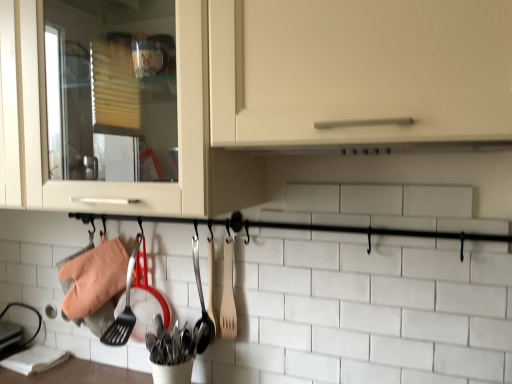
Identify the location of wooden spatula at center. This screenshot has width=512, height=384. (228, 291).

Find the location of a particular element. wooden spoon at center, arranged as the 2th silverware when viewed from the left is located at coordinates (201, 304).

The width and height of the screenshot is (512, 384). I want to click on polished stainless steel utensils at center, which ranks as the 2th silverware in right-to-left order, so click(177, 342).

Is polished stainless steel utensils at center, arranged as the first silverware when viewed from the left, a part of matte white cabinet at center?

No.

Which of these two, matte white cabinet at center or polished stainless steel utensils at center, which ranks as the 2th silverware in right-to-left order, stands shorter?

polished stainless steel utensils at center, which ranks as the 2th silverware in right-to-left order, is shorter.

Does matte white cabinet at center appear on the left side of polished stainless steel utensils at center, arranged as the first silverware when viewed from the left?

Yes, matte white cabinet at center is to the left of polished stainless steel utensils at center, arranged as the first silverware when viewed from the left.

Does point (32, 203) appear closer or farther from the camera than point (203, 334)?

Point (32, 203) is positioned closer to the camera compared to point (203, 334).

Can you confirm if matte white cabinet at center is bigger than wooden spoon at center, arranged as the 2th silverware when viewed from the left?

Correct, matte white cabinet at center is larger in size than wooden spoon at center, arranged as the 2th silverware when viewed from the left.

Would you say matte white cabinet at center is to the left or to the right of wooden spoon at center, which ranks as the first silverware in right-to-left order, in the picture?

matte white cabinet at center is positioned on wooden spoon at center, which ranks as the first silverware in right-to-left order,'s left side.

How different are the orientations of matte white cabinet at center and wooden spoon at center, arranged as the 2th silverware when viewed from the left, in degrees?

0.742 degrees.

From the image's perspective, is polished stainless steel utensils at center, which ranks as the 2th silverware in right-to-left order, above wooden spatula at center?

No, from the image's perspective, polished stainless steel utensils at center, which ranks as the 2th silverware in right-to-left order, is not on top of wooden spatula at center.

From a real-world perspective, does polished stainless steel utensils at center, arranged as the first silverware when viewed from the left, stand above wooden spatula at center?

No, from a real-world perspective, polished stainless steel utensils at center, arranged as the first silverware when viewed from the left, is not on top of wooden spatula at center.

In the scene shown: Are polished stainless steel utensils at center, which ranks as the 2th silverware in right-to-left order, and wooden spatula at center making contact?

No.

Is polished stainless steel utensils at center, which ranks as the 2th silverware in right-to-left order, closer to the viewer compared to wooden spatula at center?

Yes, it is.

Is wooden spoon at center, arranged as the 2th silverware when viewed from the left, touching matte white cabinet at center?

Result: There is a gap between wooden spoon at center, arranged as the 2th silverware when viewed from the left, and matte white cabinet at center.

This screenshot has height=384, width=512. Identify the location of the 1st silverware located beneath the matte white cabinet at center (from a real-world perspective). coord(201,304).

Consider the image. Is matte white cabinet at center completely or partially inside wooden spoon at center, arranged as the 2th silverware when viewed from the left?

Definitely not — matte white cabinet at center is not inside wooden spoon at center, arranged as the 2th silverware when viewed from the left.

Considering their positions, is wooden spoon at center, which ranks as the first silverware in right-to-left order, located in front of or behind matte white cabinet at center?

wooden spoon at center, which ranks as the first silverware in right-to-left order, is positioned farther from the viewer than matte white cabinet at center.

Can you confirm if wooden spoon at center, which ranks as the first silverware in right-to-left order, is bigger than polished stainless steel utensils at center, arranged as the first silverware when viewed from the left?

No.

In order to click on silverware below the wooden spoon at center, arranged as the 2th silverware when viewed from the left (from the image's perspective) in this screenshot , I will do `click(177, 342)`.

From the image's perspective, is wooden spoon at center, which ranks as the first silverware in right-to-left order, located above polished stainless steel utensils at center, which ranks as the 2th silverware in right-to-left order?

Correct, wooden spoon at center, which ranks as the first silverware in right-to-left order, appears higher than polished stainless steel utensils at center, which ranks as the 2th silverware in right-to-left order, in the image.

Between wooden spoon at center, which ranks as the first silverware in right-to-left order, and polished stainless steel utensils at center, arranged as the first silverware when viewed from the left, which one has less height?

polished stainless steel utensils at center, arranged as the first silverware when viewed from the left, is shorter.

Does matte white cabinet at center have a greater height compared to wooden spatula at center?

Yes, matte white cabinet at center is taller than wooden spatula at center.

Is matte white cabinet at center oriented away from wooden spatula at center?

No.

Which is more to the left, matte white cabinet at center or wooden spatula at center?

matte white cabinet at center is more to the left.

Considering the sizes of objects matte white cabinet at center and wooden spatula at center in the image provided, who is wider, matte white cabinet at center or wooden spatula at center?

matte white cabinet at center.

Considering the sizes of objects wooden spoon at center, which ranks as the first silverware in right-to-left order, and wooden spatula at center in the image provided, who is thinner, wooden spoon at center, which ranks as the first silverware in right-to-left order, or wooden spatula at center?

With smaller width is wooden spoon at center, which ranks as the first silverware in right-to-left order.

From a real-world perspective, is wooden spoon at center, arranged as the 2th silverware when viewed from the left, physically located above or below wooden spatula at center?

Clearly, from a real-world perspective, wooden spoon at center, arranged as the 2th silverware when viewed from the left, is below wooden spatula at center.

Find the location of a particular element. Image resolution: width=512 pixels, height=384 pixels. silverware that appears behind the wooden spatula at center is located at coordinates click(x=201, y=304).

Is wooden spoon at center, which ranks as the first silverware in right-to-left order, located outside wooden spatula at center?

Indeed, wooden spoon at center, which ranks as the first silverware in right-to-left order, is completely outside wooden spatula at center.

Starting from the matte white cabinet at center, which silverware is the 1st one behind? Please provide its 2D coordinates.

[(177, 342)]

Locate an element on the screen. the 2nd silverware to the right of the matte white cabinet at center, starting your count from the anchor is located at coordinates (201, 304).

Based on their spatial positions, is polished stainless steel utensils at center, arranged as the first silverware when viewed from the left, or wooden spoon at center, which ranks as the first silverware in right-to-left order, further from wooden spatula at center?

→ Among the two, polished stainless steel utensils at center, arranged as the first silverware when viewed from the left, is located further to wooden spatula at center.

Looking at the image, which one is located closer to wooden spatula at center, polished stainless steel utensils at center, which ranks as the 2th silverware in right-to-left order, or matte white cabinet at center?

polished stainless steel utensils at center, which ranks as the 2th silverware in right-to-left order, lies closer to wooden spatula at center than the other object.

Based on the photo, estimate the real-world distances between objects in this image. Which object is further from matte white cabinet at center, wooden spoon at center, which ranks as the first silverware in right-to-left order, or wooden spatula at center?

Based on the image, wooden spoon at center, which ranks as the first silverware in right-to-left order, appears to be further to matte white cabinet at center.

Estimate the real-world distances between objects in this image. Which object is closer to polished stainless steel utensils at center, arranged as the first silverware when viewed from the left, wooden spoon at center, which ranks as the first silverware in right-to-left order, or matte white cabinet at center?

wooden spoon at center, which ranks as the first silverware in right-to-left order, is closer to polished stainless steel utensils at center, arranged as the first silverware when viewed from the left.

Consider the image. Estimate the real-world distances between objects in this image. Which object is closer to matte white cabinet at center, polished stainless steel utensils at center, arranged as the first silverware when viewed from the left, or wooden spatula at center?

Among the two, wooden spatula at center is located nearer to matte white cabinet at center.

Which object lies nearer to the anchor point wooden spatula at center, wooden spoon at center, which ranks as the first silverware in right-to-left order, or polished stainless steel utensils at center, arranged as the first silverware when viewed from the left?

wooden spoon at center, which ranks as the first silverware in right-to-left order, is positioned closer to the anchor wooden spatula at center.

When comparing their distances from polished stainless steel utensils at center, which ranks as the 2th silverware in right-to-left order, does matte white cabinet at center or wooden spatula at center seem closer?

Among the two, wooden spatula at center is located nearer to polished stainless steel utensils at center, which ranks as the 2th silverware in right-to-left order.

Looking at the image, which one is located closer to wooden spoon at center, which ranks as the first silverware in right-to-left order, wooden spatula at center or polished stainless steel utensils at center, arranged as the first silverware when viewed from the left?

The object closer to wooden spoon at center, which ranks as the first silverware in right-to-left order, is polished stainless steel utensils at center, arranged as the first silverware when viewed from the left.

You are a GUI agent. You are given a task and a screenshot of the screen. Output one action in this format:
    pyautogui.click(x=<x>, y=<y>)
    Task: Click on the spatula between matte white cabinet at center and wooden spoon at center, which ranks as the first silverware in right-to-left order, from front to back
    This screenshot has height=384, width=512.
    Given the screenshot: What is the action you would take?
    pyautogui.click(x=228, y=291)

You are a GUI agent. You are given a task and a screenshot of the screen. Output one action in this format:
    pyautogui.click(x=<x>, y=<y>)
    Task: Click on the spatula between matte white cabinet at center and polished stainless steel utensils at center, arranged as the first silverware when viewed from the left, from top to bottom
    The image size is (512, 384).
    Given the screenshot: What is the action you would take?
    pyautogui.click(x=228, y=291)

Identify the location of silverware between matte white cabinet at center and polished stainless steel utensils at center, which ranks as the 2th silverware in right-to-left order, from top to bottom. Image resolution: width=512 pixels, height=384 pixels. (201, 304).

Image resolution: width=512 pixels, height=384 pixels. In order to click on silverware between wooden spatula at center and polished stainless steel utensils at center, which ranks as the 2th silverware in right-to-left order, in the up-down direction in this screenshot , I will do `click(201, 304)`.